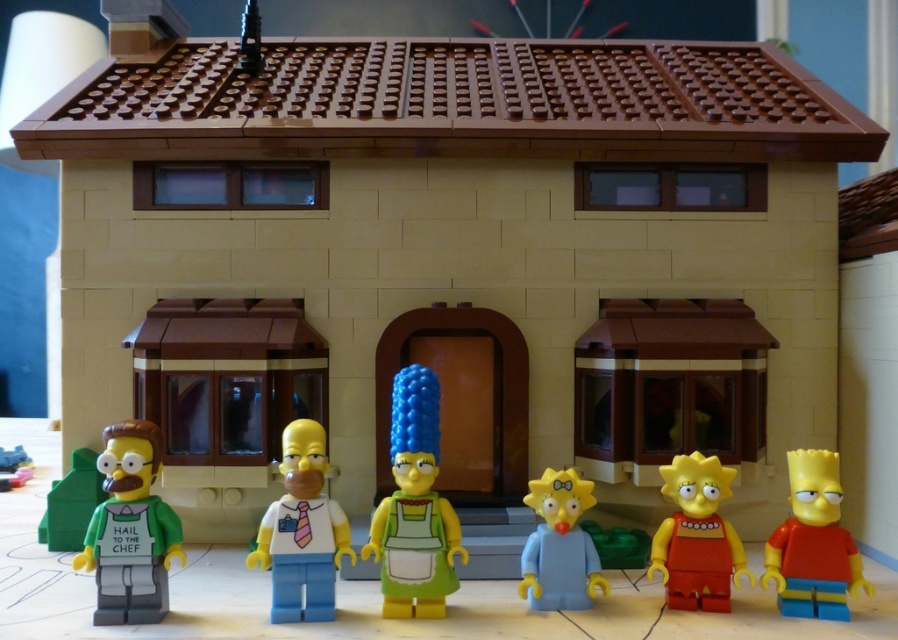
Question: Observing the image, what is the correct spatial positioning of matte green plastic figure at center in reference to smooth plastic toy at lower left?

Choices:
 (A) below
 (B) above

Answer: (B)

Question: Is matte green plastic figure at center thinner than white matte shirt and tie at center?

Choices:
 (A) no
 (B) yes

Answer: (A)

Question: Which point appears closest to the camera in this image?

Choices:
 (A) (606, 582)
 (B) (0, 461)

Answer: (A)

Question: Can you confirm if rubberized red shirt at right is positioned to the left of light blue plastic maggie simpson at center?

Choices:
 (A) yes
 (B) no

Answer: (B)

Question: Among these points, which one is farthest from the camera?

Choices:
 (A) pyautogui.click(x=115, y=456)
 (B) pyautogui.click(x=594, y=561)
 (C) pyautogui.click(x=434, y=387)

Answer: (C)

Question: Which of the following is the farthest from the observer?

Choices:
 (A) white matte shirt and tie at center
 (B) smooth plastic toy at lower left
 (C) matte red dress at lower right

Answer: (B)